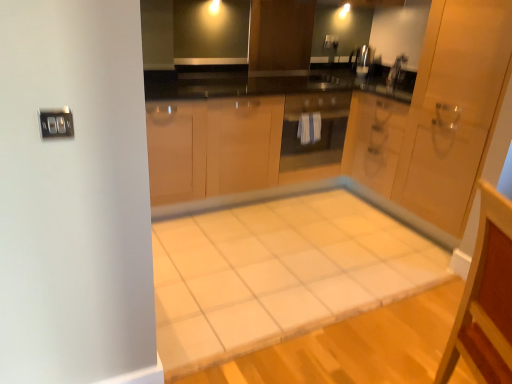
Question: Does white tile vanity at lower right come behind white tile table at center?

Choices:
 (A) no
 (B) yes

Answer: (A)

Question: Is white tile vanity at lower right smaller than white tile table at center?

Choices:
 (A) no
 (B) yes

Answer: (A)

Question: Is white tile vanity at lower right taller than white tile table at center?

Choices:
 (A) yes
 (B) no

Answer: (A)

Question: Does white tile vanity at lower right appear on the right side of white tile table at center?

Choices:
 (A) yes
 (B) no

Answer: (A)

Question: From the image's perspective, would you say white tile vanity at lower right is shown under white tile table at center?

Choices:
 (A) no
 (B) yes

Answer: (B)

Question: In the image, is matte glass oven at center on the left side or the right side of satin nickel faucet at upper center?

Choices:
 (A) right
 (B) left

Answer: (B)

Question: In terms of width, does matte glass oven at center look wider or thinner when compared to satin nickel faucet at upper center?

Choices:
 (A) thin
 (B) wide

Answer: (B)

Question: Is matte glass oven at center bigger or smaller than satin nickel faucet at upper center?

Choices:
 (A) small
 (B) big

Answer: (B)

Question: Choose the correct answer: Is matte glass oven at center inside satin nickel faucet at upper center or outside it?

Choices:
 (A) inside
 (B) outside

Answer: (B)

Question: Is point click(x=379, y=241) closer or farther from the camera than point click(x=463, y=66)?

Choices:
 (A) farther
 (B) closer

Answer: (A)

Question: Do you think white tile table at center is within wooden door at right, or outside of it?

Choices:
 (A) inside
 (B) outside

Answer: (B)

Question: Relative to wooden door at right, is white tile table at center in front or behind?

Choices:
 (A) behind
 (B) front

Answer: (B)

Question: Is white tile table at center taller or shorter than wooden door at right?

Choices:
 (A) short
 (B) tall

Answer: (A)

Question: In the image, is matte glass oven at center on the left side or the right side of white tile vanity at lower right?

Choices:
 (A) right
 (B) left

Answer: (B)

Question: From the image's perspective, is matte glass oven at center positioned above or below white tile vanity at lower right?

Choices:
 (A) above
 (B) below

Answer: (A)